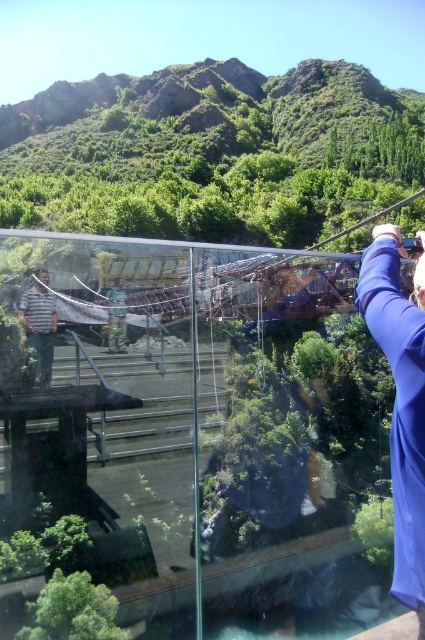
Between blue fabric at right and camouflage fabric jacket at center, which one has more height?

blue fabric at right

Can you confirm if blue fabric at right is thinner than camouflage fabric jacket at center?

No.

Which is behind, point (397, 544) or point (110, 349)?

Positioned behind is point (110, 349).

I want to click on blue fabric at right, so point(401,401).

Is point (48, 323) more distant than point (116, 316)?

No.

What do you see at coordinates (39, 324) in the screenshot? The width and height of the screenshot is (425, 640). I see `striped fabric shirt at left` at bounding box center [39, 324].

Who is more distant from viewer, (17, 312) or (119, 337)?

Point (119, 337)

The width and height of the screenshot is (425, 640). Find the location of `striped fabric shirt at left`. striped fabric shirt at left is located at coordinates (39, 324).

Does blue fabric at right appear under striped fabric shirt at left?

Indeed, blue fabric at right is positioned under striped fabric shirt at left.

Which is below, blue fabric at right or striped fabric shirt at left?

blue fabric at right

Is point (379, 308) positioned behind point (17, 310)?

No.

You are a GUI agent. You are given a task and a screenshot of the screen. Output one action in this format:
    pyautogui.click(x=<x>, y=<y>)
    Task: Click on the blue fabric at right
    This screenshot has width=425, height=640.
    Given the screenshot: What is the action you would take?
    pyautogui.click(x=401, y=401)